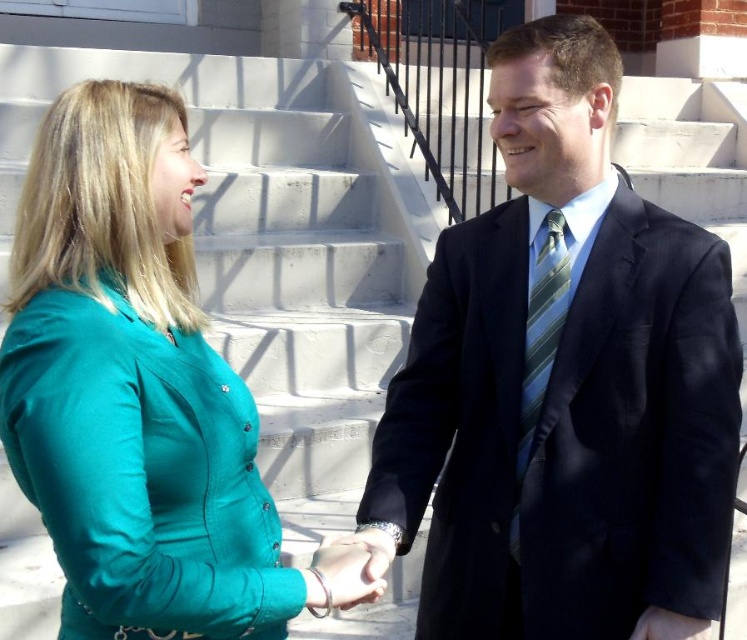
Question: Which is farther from the teal fabric blouse at left?

Choices:
 (A) green striped tie at center
 (B) matte black suit at center
 (C) teal fabric hand at center
 (D) smooth black hand at center

Answer: (D)

Question: Which object is positioned farthest from the matte black suit at center?

Choices:
 (A) green striped tie at center
 (B) teal fabric blouse at left

Answer: (B)

Question: Considering the real-world distances, which object is farthest from the green striped tie at center?

Choices:
 (A) matte black suit at center
 (B) teal fabric hand at center

Answer: (B)

Question: Does teal fabric blouse at left appear on the right side of teal fabric hand at center?

Choices:
 (A) no
 (B) yes

Answer: (A)

Question: Is teal fabric blouse at left positioned before green striped tie at center?

Choices:
 (A) yes
 (B) no

Answer: (A)

Question: Is matte black suit at center above green striped tie at center?

Choices:
 (A) no
 (B) yes

Answer: (B)